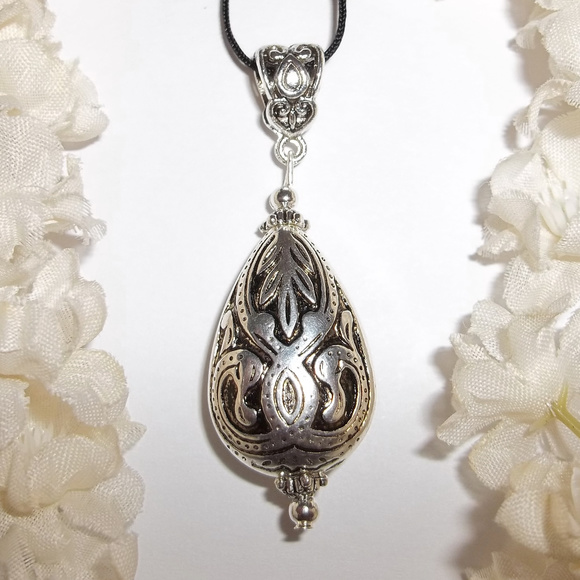
Image resolution: width=580 pixels, height=580 pixels. What are the coordinates of `pendant` in the screenshot? It's located at (282, 350).